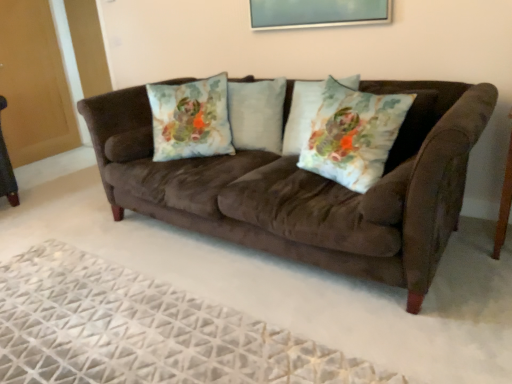
This screenshot has width=512, height=384. I want to click on vacant region to the left of suede couch at center, so click(x=79, y=252).